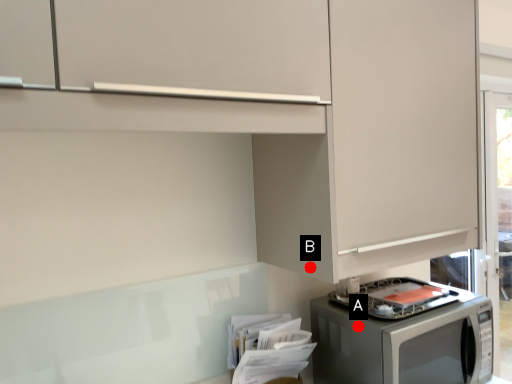
Question: Two points are circled on the image, labeled by A and B beside each circle. Which point is closer to the camera taking this photo?

Choices:
 (A) A is closer
 (B) B is closer

Answer: (B)